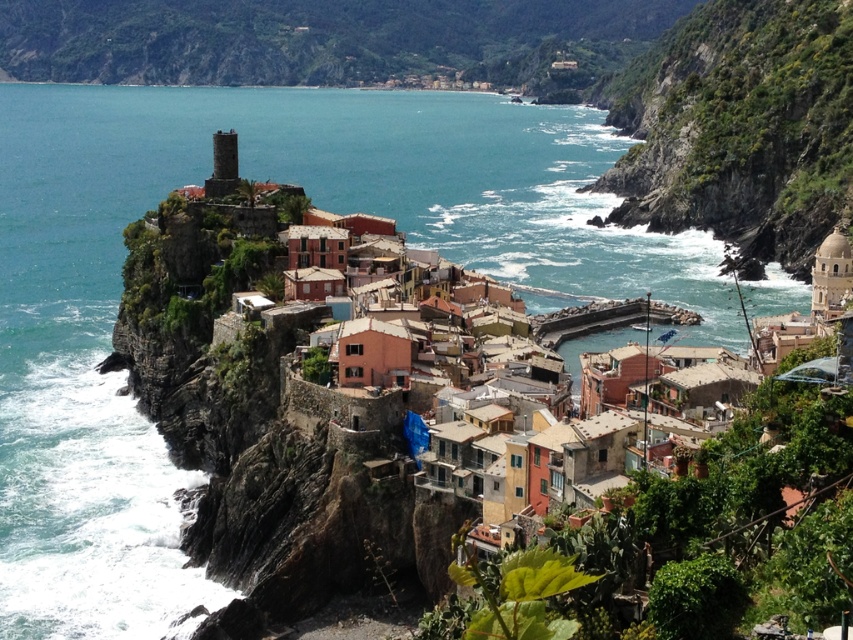
Is green leafy hillside at upper center to the right of green mossy rock at center right from the viewer's perspective?

No, green leafy hillside at upper center is not to the right of green mossy rock at center right.

Based on the photo, which is above, green leafy hillside at upper center or green mossy rock at center right?

Positioned higher is green leafy hillside at upper center.

Between point (519, 13) and point (734, 179), which one is positioned in front?

Point (734, 179) is in front.

Find the location of `green leafy hillside at upper center`. green leafy hillside at upper center is located at coordinates (332, 42).